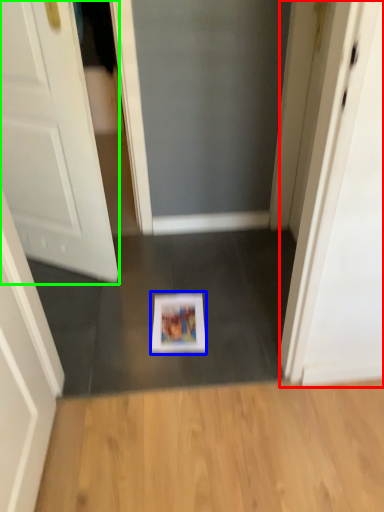
Question: Considering the real-world distances, which object is closest to screen door (highlighted by a red box)? magazine (highlighted by a blue box) or door (highlighted by a green box).

Choices:
 (A) magazine
 (B) door

Answer: (A)